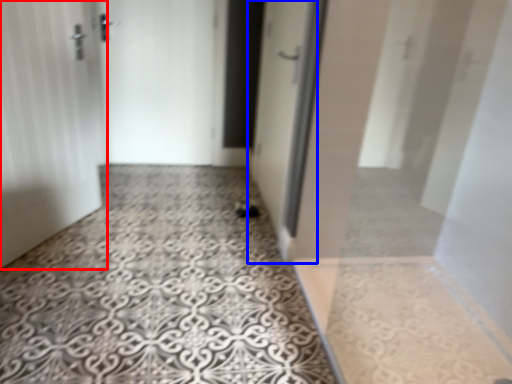
Question: Among these objects, which one is nearest to the camera, door (highlighted by a red box) or door (highlighted by a blue box)?

Choices:
 (A) door
 (B) door

Answer: (A)